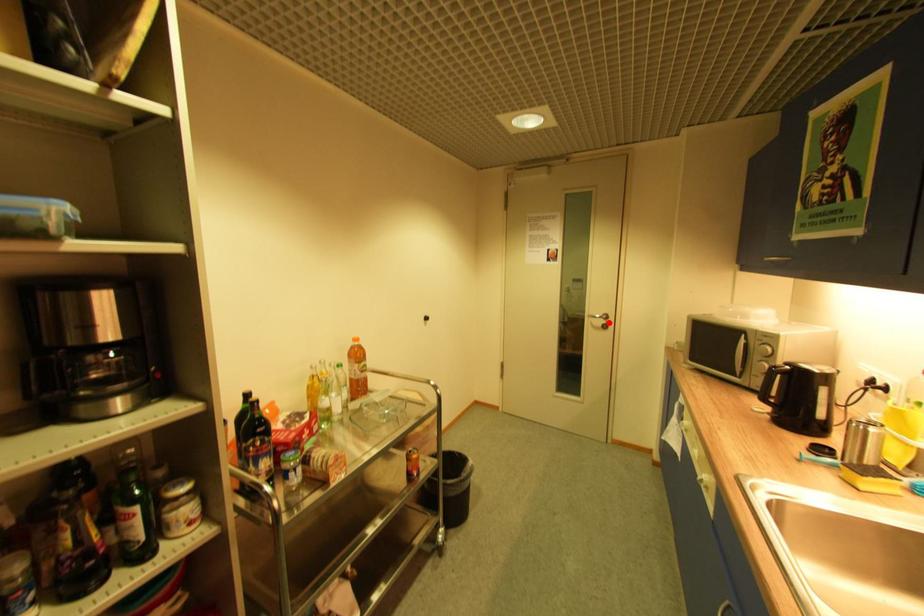
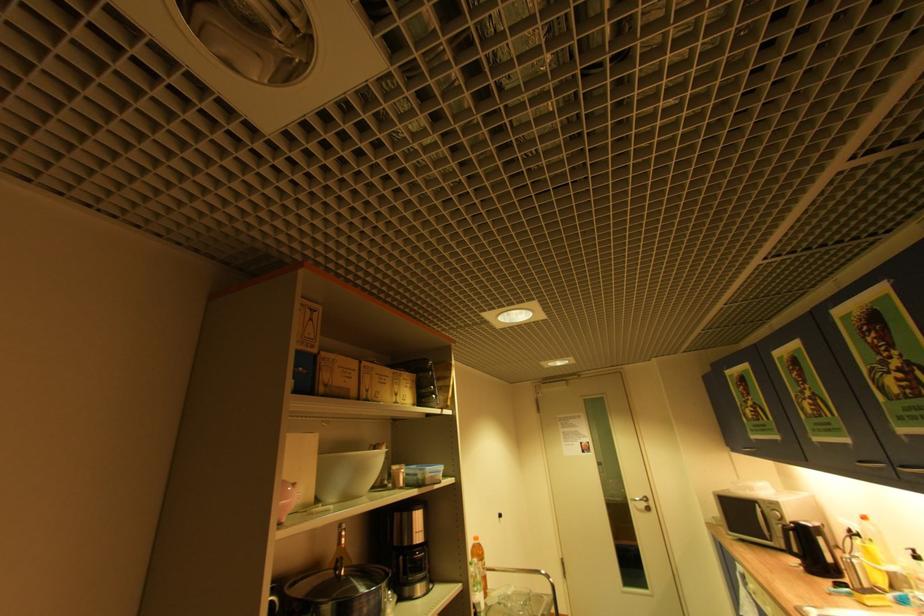
Question: I am providing you with two images of the same scene from different viewpoints. Given a red point in image1, look at the same physical point in image2. Is it:

Choices:
 (A) Closer to the viewpoint
 (B) Farther from the viewpoint

Answer: (B)